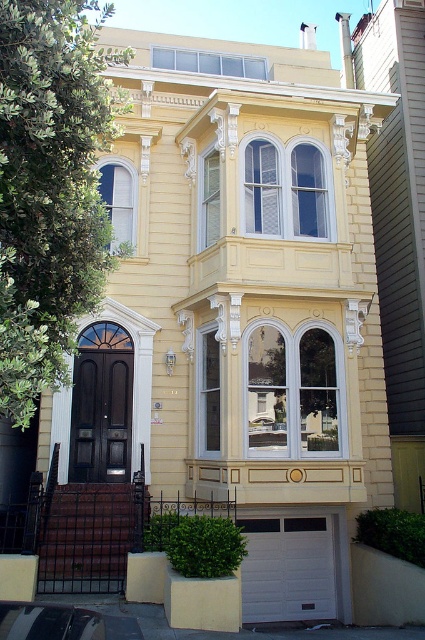
You are an architect analyzing the Victorian house. You need to determine which window has a greater width between the matte glass bay window at center and the clear glass window at upper center. Based on the provided scene description, which window is wider?

The clear glass window at upper center is wider than the matte glass bay window at center because the description states that the matte glass bay window at center is thinner than the clear glass window at upper center.

You are standing in front of the Victorian house and notice two points marked on the facade. The first point is at coordinates point [189,67] and the second is at point [215,200]. From your perspective, which point is closer to you?

Point [215,200] is closer to you because it is in front of point [189,67] according to their spatial relationship.

You are a window installer assessing the house. You need to replace the glass for both the matte glass bay window at center and the clear glass window at upper center. Which window requires a taller piece of glass?

The matte glass bay window at center requires a taller piece of glass because it is taller than the clear glass window at upper center.